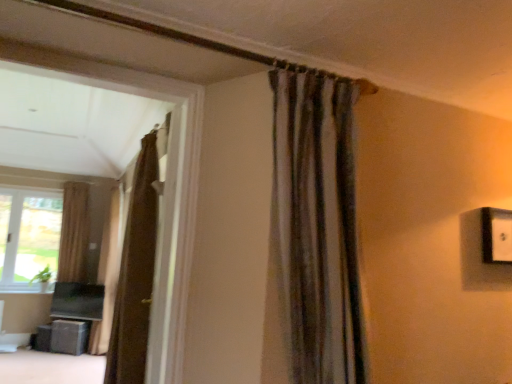
Question: Is clear glass window at left in front of or behind transparent plastic screen door at center in the image?

Choices:
 (A) behind
 (B) front

Answer: (A)

Question: Is clear glass window at left to the left or to the right of transparent plastic screen door at center in the image?

Choices:
 (A) left
 (B) right

Answer: (A)

Question: Based on their relative distances, which object is nearer to the textured gray curtain at upper center, positioned as the 4th curtain in back-to-front order?

Choices:
 (A) beige fabric curtain at left, acting as the first curtain starting from the back
 (B) matte black speaker at lower left
 (C) brown textured curtain at upper left, which appears as the second curtain when viewed from the right
 (D) brown textured curtain at center, the 2th curtain in the left-to-right sequence
 (E) clear glass window at left

Answer: (C)

Question: Estimate the real-world distances between objects in this image. Which object is closer to the clear glass window at left?

Choices:
 (A) brown textured curtain at upper left, which ranks as the 3th curtain in back-to-front order
 (B) textured gray curtain at upper center, placed as the 4th curtain when sorted from left to right
 (C) matte black speaker at lower left
 (D) transparent plastic screen door at center
 (E) beige fabric curtain at left, acting as the first curtain starting from the back

Answer: (E)